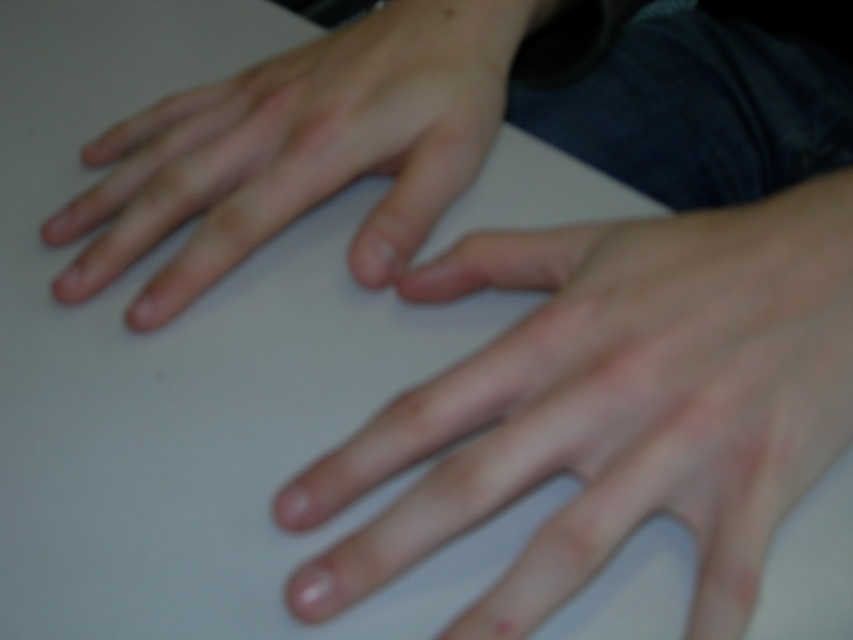
Question: Can you confirm if smooth skin hand at center is positioned to the right of smooth skin hand at upper left?

Choices:
 (A) yes
 (B) no

Answer: (A)

Question: Where is smooth skin hand at center located in relation to smooth skin hand at upper left in the image?

Choices:
 (A) below
 (B) above

Answer: (A)

Question: Which object is closer to the camera taking this photo?

Choices:
 (A) smooth skin hand at center
 (B) smooth skin hand at upper left

Answer: (A)

Question: Among these points, which one is farthest from the camera?

Choices:
 (A) (624, 444)
 (B) (434, 109)

Answer: (B)

Question: Is smooth skin hand at center smaller than smooth skin hand at upper left?

Choices:
 (A) no
 (B) yes

Answer: (B)